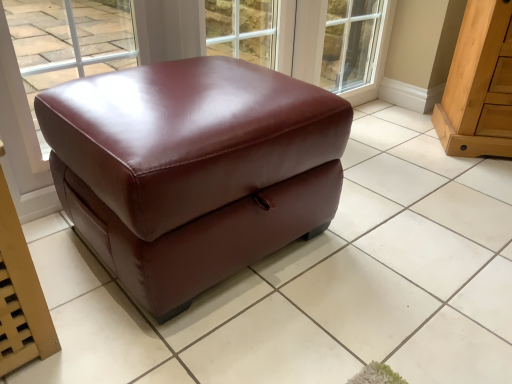
Measure the distance between point [106,14] and camera.

Point [106,14] is 8.53 feet away from camera.

Measure the distance between point (114,85) and camera.

Point (114,85) is 3.37 feet from camera.

Where is `light brown wood drawer at right, placed as the 1th furniture when sorted from right to left`? light brown wood drawer at right, placed as the 1th furniture when sorted from right to left is located at coordinates (477, 85).

Can you confirm if transparent glass window at upper center is shorter than satin brown leather ottoman at center, the 1th furniture from the left?

No, transparent glass window at upper center is not shorter than satin brown leather ottoman at center, the 1th furniture from the left.

The image size is (512, 384). I want to click on window behind the satin brown leather ottoman at center, the 2th furniture in the right-to-left sequence, so (x=68, y=43).

Considering the relative positions of transparent glass window at upper center and satin brown leather ottoman at center, the 1th furniture from the left, in the image provided, is transparent glass window at upper center to the right of satin brown leather ottoman at center, the 1th furniture from the left, from the viewer's perspective?

Incorrect, transparent glass window at upper center is not on the right side of satin brown leather ottoman at center, the 1th furniture from the left.

From a real-world perspective, between transparent glass window at upper center and light brown wood drawer at right, which appears as the second furniture when viewed from the left, who is vertically higher?

In real-world perspective, transparent glass window at upper center is above.

Are transparent glass window at upper center and light brown wood drawer at right, which appears as the second furniture when viewed from the left, making contact?

No.

Could you tell me if transparent glass window at upper center is facing light brown wood drawer at right, placed as the 1th furniture when sorted from right to left?

No, transparent glass window at upper center does not turn towards light brown wood drawer at right, placed as the 1th furniture when sorted from right to left.

Locate an element on the screen. The height and width of the screenshot is (384, 512). window that is in front of the light brown wood drawer at right, placed as the 1th furniture when sorted from right to left is located at coordinates (68, 43).

Would you say satin brown leather ottoman at center, the 2th furniture in the right-to-left sequence, is a long distance from light brown wood drawer at right, placed as the 1th furniture when sorted from right to left?

satin brown leather ottoman at center, the 2th furniture in the right-to-left sequence, is positioned a significant distance from light brown wood drawer at right, placed as the 1th furniture when sorted from right to left.

From a real-world perspective, is satin brown leather ottoman at center, the 2th furniture in the right-to-left sequence, above or below light brown wood drawer at right, which appears as the second furniture when viewed from the left?

Clearly, from a real-world perspective, satin brown leather ottoman at center, the 2th furniture in the right-to-left sequence, is below light brown wood drawer at right, which appears as the second furniture when viewed from the left.

At what (x,y) coordinates should I click in order to perform the action: click on furniture below the light brown wood drawer at right, placed as the 1th furniture when sorted from right to left (from a real-world perspective). Please return your answer as a coordinate pair (x, y). The width and height of the screenshot is (512, 384). Looking at the image, I should click on pyautogui.click(x=193, y=169).

Is satin brown leather ottoman at center, the 2th furniture in the right-to-left sequence, positioned beyond the bounds of light brown wood drawer at right, placed as the 1th furniture when sorted from right to left?

satin brown leather ottoman at center, the 2th furniture in the right-to-left sequence, lies outside light brown wood drawer at right, placed as the 1th furniture when sorted from right to left,'s area.

Could you measure the distance between satin brown leather ottoman at center, the 1th furniture from the left, and transparent glass window at upper center?

satin brown leather ottoman at center, the 1th furniture from the left, and transparent glass window at upper center are 1.20 meters apart from each other.

Between point (176, 264) and point (64, 54), which one is positioned behind?

The point (64, 54) is more distant.

Is satin brown leather ottoman at center, the 1th furniture from the left, oriented away from transparent glass window at upper center?

Absolutely, satin brown leather ottoman at center, the 1th furniture from the left, is directed away from transparent glass window at upper center.

Does light brown wood drawer at right, placed as the 1th furniture when sorted from right to left, have a lesser width compared to transparent glass window at upper center?

No.

Between light brown wood drawer at right, which appears as the second furniture when viewed from the left, and transparent glass window at upper center, which one is positioned behind?

Positioned behind is light brown wood drawer at right, which appears as the second furniture when viewed from the left.

How many degrees apart are the facing directions of light brown wood drawer at right, placed as the 1th furniture when sorted from right to left, and transparent glass window at upper center?

light brown wood drawer at right, placed as the 1th furniture when sorted from right to left, and transparent glass window at upper center are facing 50.6 degrees away from each other.

Can we say light brown wood drawer at right, which appears as the second furniture when viewed from the left, lies outside transparent glass window at upper center?

light brown wood drawer at right, which appears as the second furniture when viewed from the left, lies outside transparent glass window at upper center's area.

Would you consider light brown wood drawer at right, placed as the 1th furniture when sorted from right to left, to be distant from satin brown leather ottoman at center, the 2th furniture in the right-to-left sequence?

Indeed, light brown wood drawer at right, placed as the 1th furniture when sorted from right to left, is not near satin brown leather ottoman at center, the 2th furniture in the right-to-left sequence.

Identify the location of furniture that is on the right side of satin brown leather ottoman at center, the 2th furniture in the right-to-left sequence. The width and height of the screenshot is (512, 384). (477, 85).

From the image's perspective, between light brown wood drawer at right, which appears as the second furniture when viewed from the left, and satin brown leather ottoman at center, the 1th furniture from the left, which one is located above?

light brown wood drawer at right, which appears as the second furniture when viewed from the left, is shown above in the image.

Is the depth of light brown wood drawer at right, which appears as the second furniture when viewed from the left, greater than that of satin brown leather ottoman at center, the 1th furniture from the left?

Yes, light brown wood drawer at right, which appears as the second furniture when viewed from the left, is further from the viewer.

Starting from the transparent glass window at upper center, which furniture is the 1st one to the right? Please provide its 2D coordinates.

[(193, 169)]

Locate an element on the screen. The width and height of the screenshot is (512, 384). furniture lying above the transparent glass window at upper center (from the image's perspective) is located at coordinates (477, 85).

Consider the image. Based on their spatial positions, is light brown wood drawer at right, placed as the 1th furniture when sorted from right to left, or transparent glass window at upper center closer to satin brown leather ottoman at center, the 2th furniture in the right-to-left sequence?

The object closer to satin brown leather ottoman at center, the 2th furniture in the right-to-left sequence, is light brown wood drawer at right, placed as the 1th furniture when sorted from right to left.

In the scene shown: From the image, which object appears to be farther from light brown wood drawer at right, which appears as the second furniture when viewed from the left, satin brown leather ottoman at center, the 2th furniture in the right-to-left sequence, or transparent glass window at upper center?

transparent glass window at upper center is further to light brown wood drawer at right, which appears as the second furniture when viewed from the left.

When comparing their distances from transparent glass window at upper center, does satin brown leather ottoman at center, the 1th furniture from the left, or light brown wood drawer at right, placed as the 1th furniture when sorted from right to left, seem further?

light brown wood drawer at right, placed as the 1th furniture when sorted from right to left, is further to transparent glass window at upper center.

When comparing their distances from satin brown leather ottoman at center, the 2th furniture in the right-to-left sequence, does transparent glass window at upper center or light brown wood drawer at right, placed as the 1th furniture when sorted from right to left, seem further?

transparent glass window at upper center lies further to satin brown leather ottoman at center, the 2th furniture in the right-to-left sequence, than the other object.

Considering their positions, is transparent glass window at upper center positioned closer to light brown wood drawer at right, which appears as the second furniture when viewed from the left, than satin brown leather ottoman at center, the 2th furniture in the right-to-left sequence?

satin brown leather ottoman at center, the 2th furniture in the right-to-left sequence, is closer to light brown wood drawer at right, which appears as the second furniture when viewed from the left.

Estimate the real-world distances between objects in this image. Which object is closer to transparent glass window at upper center, light brown wood drawer at right, which appears as the second furniture when viewed from the left, or satin brown leather ottoman at center, the 2th furniture in the right-to-left sequence?

satin brown leather ottoman at center, the 2th furniture in the right-to-left sequence, is closer to transparent glass window at upper center.

Where is `furniture between transparent glass window at upper center and light brown wood drawer at right, placed as the 1th furniture when sorted from right to left, from left to right`? The image size is (512, 384). furniture between transparent glass window at upper center and light brown wood drawer at right, placed as the 1th furniture when sorted from right to left, from left to right is located at coordinates (193, 169).